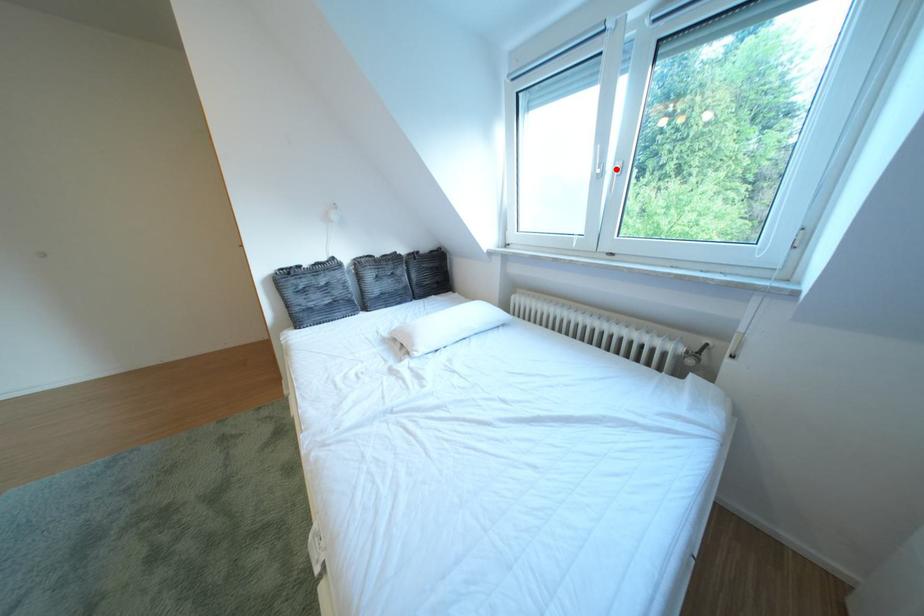
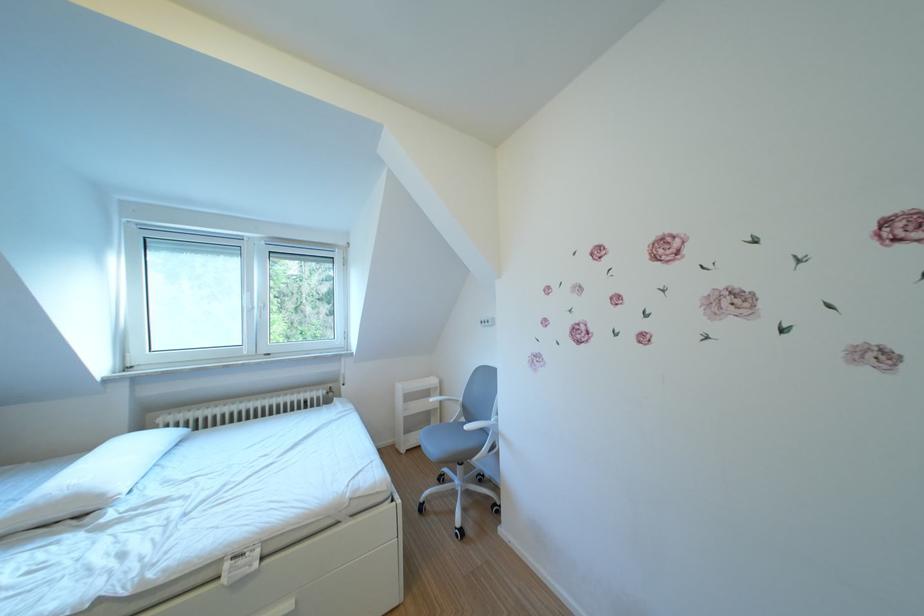
Locate, in the second image, the point that corresponds to the highlighted location in the first image.

(265, 307)